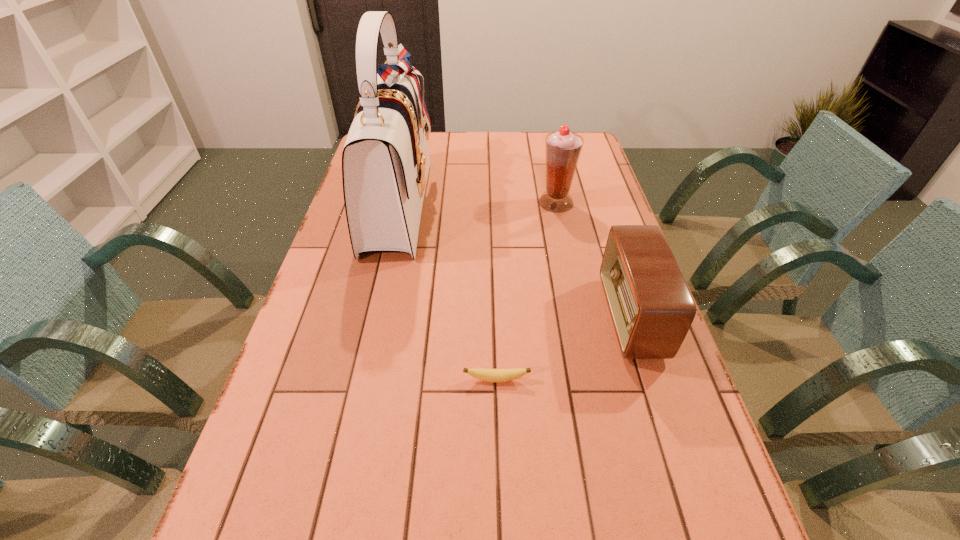
Locate an element on the screen. This screenshot has width=960, height=540. vacant position at the left edge of the desktop is located at coordinates (268, 413).

Identify the location of free space at the right edge of the desktop. (599, 162).

At what (x,y) coordinates should I click in order to perform the action: click on vacant space at the far right corner. Please return your answer as a coordinate pair (x, y). Looking at the image, I should click on (592, 159).

Where is `free spot between the rightmost object and the banana`? free spot between the rightmost object and the banana is located at coordinates (564, 349).

Where is `free point between the banana and the leftmost object`? The image size is (960, 540). free point between the banana and the leftmost object is located at coordinates (447, 292).

The width and height of the screenshot is (960, 540). I want to click on free space between the third shortest object and the leftmost object, so click(477, 203).

Where is `unoccupied position between the second shortest object and the nearest object`? unoccupied position between the second shortest object and the nearest object is located at coordinates pyautogui.click(x=564, y=349).

This screenshot has height=540, width=960. I want to click on blank region between the shortest object and the second object from right to left, so click(x=526, y=291).

Identify the location of empty space between the second tallest object and the nearest object. click(x=526, y=291).

The height and width of the screenshot is (540, 960). Find the location of `vacant area between the third shortest object and the rightmost object`. vacant area between the third shortest object and the rightmost object is located at coordinates (593, 260).